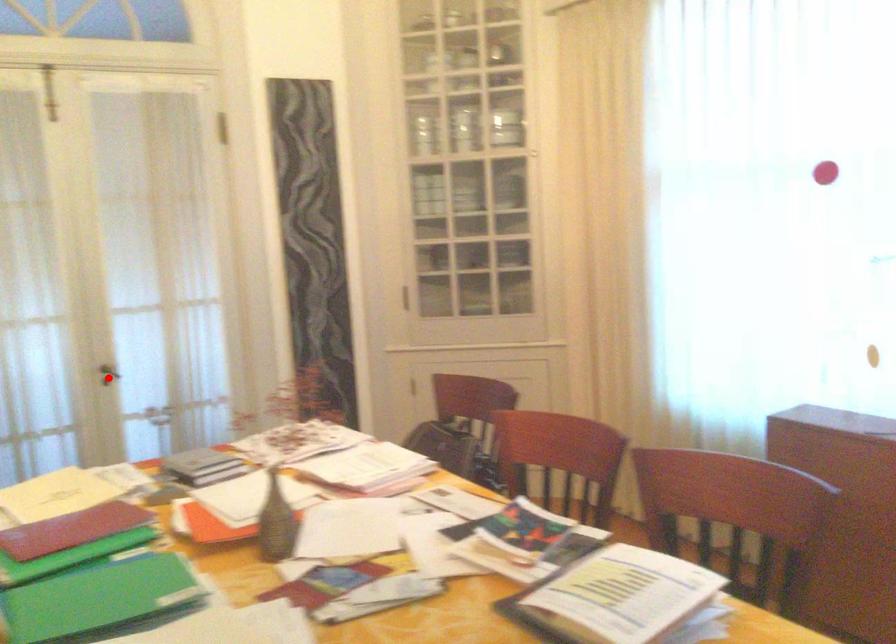
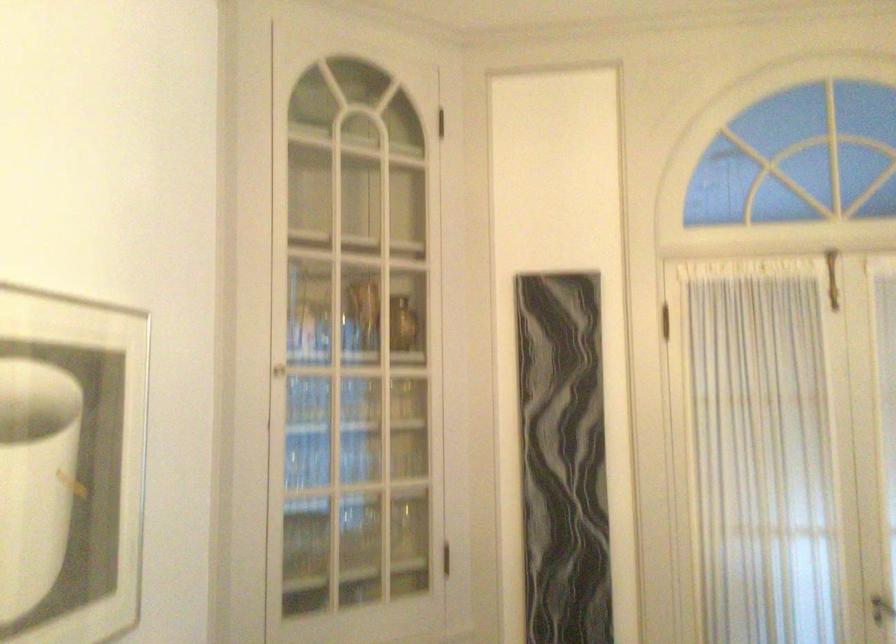
The point at the highlighted location is marked in the first image. Where is the corresponding point in the second image?

(882, 609)